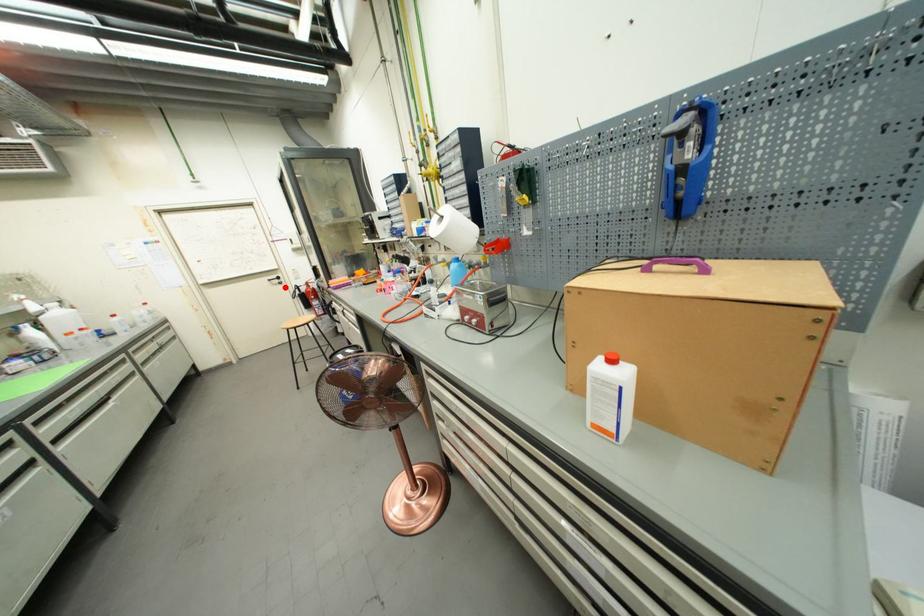
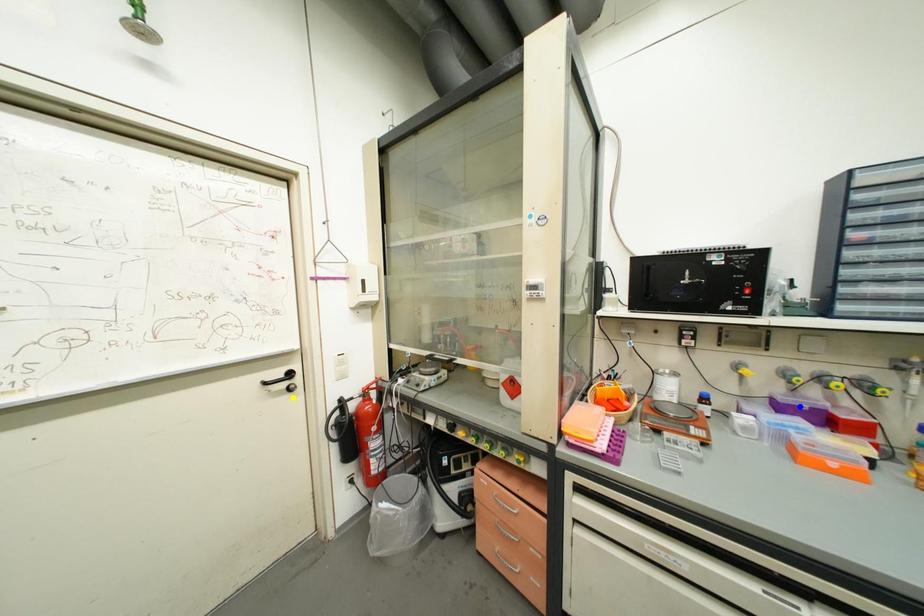
Question: I am providing you with two images of the same scene from different viewpoints. A red point is marked on the first image. You are given multiple points on the second image. Which spot in image 2 lines up with the point in image 1?

Choices:
 (A) yellow point
 (B) green point
 (C) blue point

Answer: (A)